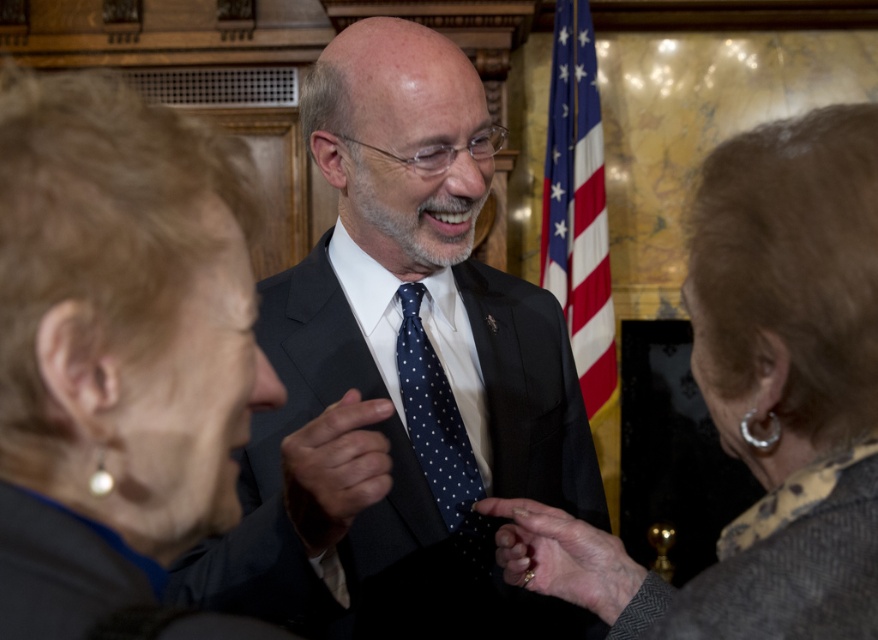
You are standing in front of the group of three people. There are two points marked in the image. The first point is at coordinates point (238, 193) and the second is at point (623, 573). Which point is closer to you?

Point (238, 193) is closer to the viewer than point (623, 573).

You are a photographer trying to capture a closeup shot of the dark blue dotted tie at center and the gold ring at center. Which object should you zoom in on more to ensure both are clearly visible in the photo?

Since the dark blue dotted tie at center is smaller than the gold ring at center, you should zoom in more on the dark blue dotted tie at center to ensure both are clearly visible in the photo.